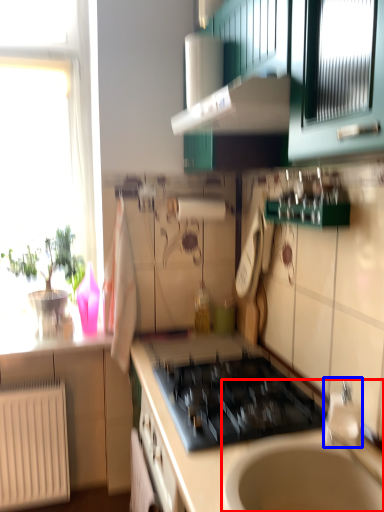
Question: Among these objects, which one is nearest to the camera, sink (highlighted by a red box) or faucet (highlighted by a blue box)?

Choices:
 (A) sink
 (B) faucet

Answer: (A)